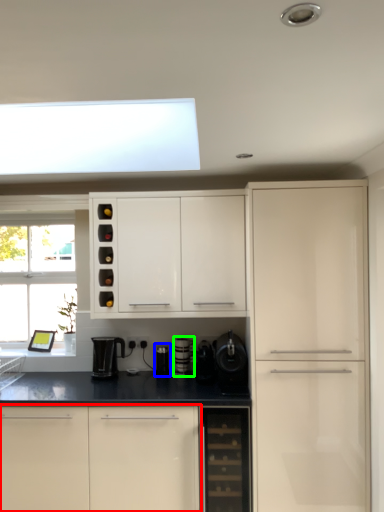
Question: Considering the real-world distances, which object is farthest from cabinetry (highlighted by a red box)? appliance (highlighted by a blue box) or appliance (highlighted by a green box)?

Choices:
 (A) appliance
 (B) appliance

Answer: (B)